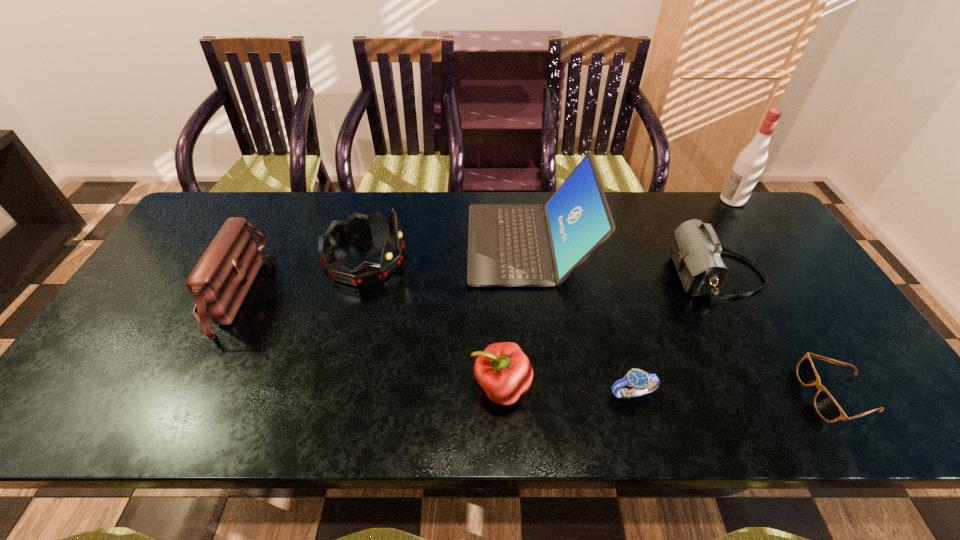
Image resolution: width=960 pixels, height=540 pixels. Identify the location of vacant space located 0.260m on the label of the alcohol. (643, 200).

Locate an element on the screen. This screenshot has width=960, height=540. free space located 0.350m on the label of the alcohol is located at coordinates (616, 200).

In order to click on vacant space located 0.110m on the screen of the laptop computer in this screenshot , I will do `click(432, 244)`.

The width and height of the screenshot is (960, 540). In order to click on vacant point located 0.300m on the screen of the laptop computer in this screenshot , I will do `click(369, 244)`.

The width and height of the screenshot is (960, 540). What are the coordinates of `free space located on the screen of the laptop computer` in the screenshot? It's located at (442, 244).

You are a GUI agent. You are given a task and a screenshot of the screen. Output one action in this format:
    pyautogui.click(x=<x>, y=<y>)
    Task: Click on the vacant region located at the front of the tiara with jewels
    This screenshot has width=960, height=540.
    Given the screenshot: What is the action you would take?
    pyautogui.click(x=542, y=259)

Find the location of `free location located on the front flap of the leftmost object`. free location located on the front flap of the leftmost object is located at coordinates (397, 292).

At what (x,y) coordinates should I click in order to perform the action: click on vacant region located 0.220m on the back of the right shoulder bag. Please return your answer as a coordinate pair (x, y). The image size is (960, 540). Looking at the image, I should click on (679, 203).

The height and width of the screenshot is (540, 960). In order to click on free space located on the right of the third shortest object in this screenshot , I will do `click(562, 387)`.

This screenshot has height=540, width=960. Find the location of `vacant space located 0.220m on the left of the seventh tallest object`. vacant space located 0.220m on the left of the seventh tallest object is located at coordinates (511, 393).